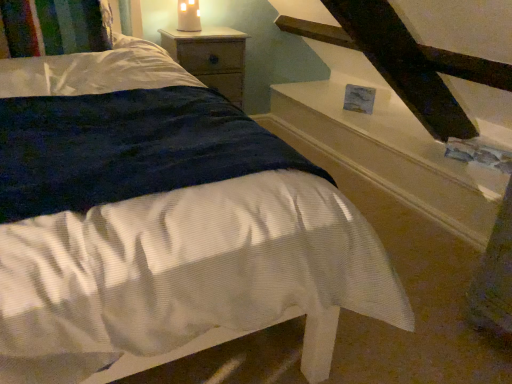
The height and width of the screenshot is (384, 512). Find the location of `free space on the front side of matte white candle at upper center`. free space on the front side of matte white candle at upper center is located at coordinates (186, 38).